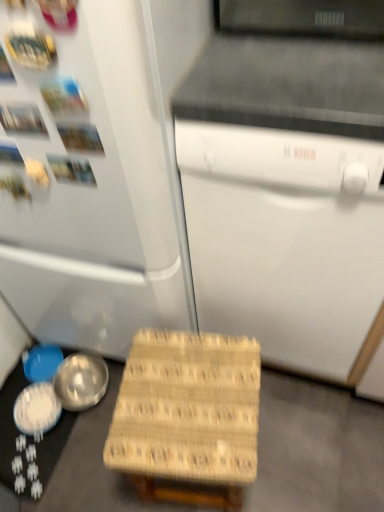
Where is `free space in front of shiny silver bowl at lower left, the 2th bowl from the left`? free space in front of shiny silver bowl at lower left, the 2th bowl from the left is located at coordinates (33, 456).